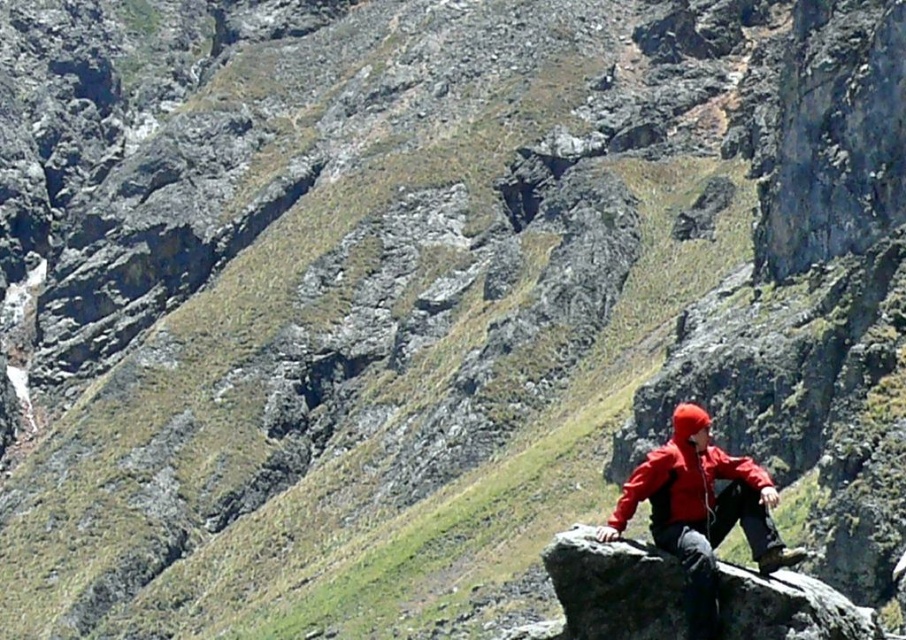
Does smooth rock at center have a smaller size compared to matte red jacket at lower right?

Indeed, smooth rock at center has a smaller size compared to matte red jacket at lower right.

The image size is (906, 640). Find the location of `smooth rock at center`. smooth rock at center is located at coordinates (615, 588).

The image size is (906, 640). What do you see at coordinates (701, 512) in the screenshot? I see `red matte jacket at lower right` at bounding box center [701, 512].

Is red matte jacket at lower right to the left of matte red jacket at lower right from the viewer's perspective?

In fact, red matte jacket at lower right is to the right of matte red jacket at lower right.

Which is in front, point (709, 490) or point (680, 470)?

Point (680, 470)

The height and width of the screenshot is (640, 906). Find the location of `red matte jacket at lower right`. red matte jacket at lower right is located at coordinates (701, 512).

Which of these two, smooth rock at center or red matte jacket at lower right, stands taller?

With more height is red matte jacket at lower right.

Consider the image. Is smooth rock at center taller than red matte jacket at lower right?

In fact, smooth rock at center may be shorter than red matte jacket at lower right.

Where is `smooth rock at center`? smooth rock at center is located at coordinates (615, 588).